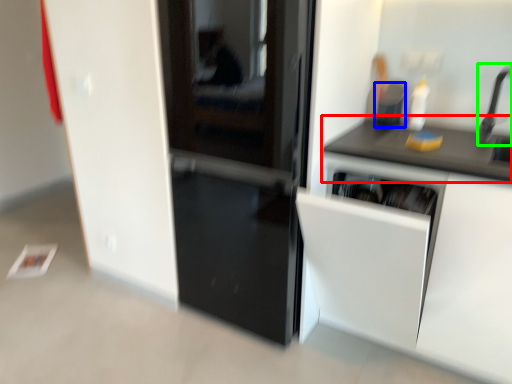
Question: Which is nearer to the countertop (highlighted by a red box)? appliance (highlighted by a blue box) or faucet (highlighted by a green box).

Choices:
 (A) appliance
 (B) faucet

Answer: (A)